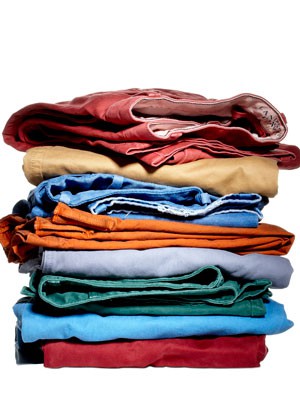
This screenshot has width=300, height=400. Identify the location of folded clothes. (111, 116), (183, 170), (185, 192), (183, 240), (182, 259), (181, 279), (181, 322), (173, 350).